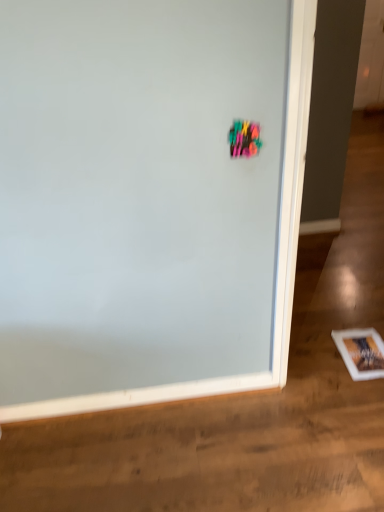
I want to click on vacant space behind white matte picture frame at lower right, so click(x=338, y=320).